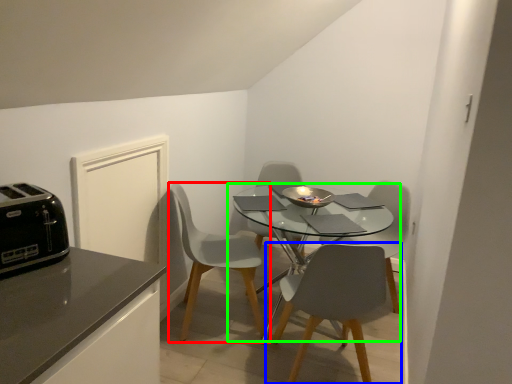
Question: Considering the real-world distances, which object is closest to chair (highlighted by a red box)? chair (highlighted by a blue box) or kitchen & dining room table (highlighted by a green box).

Choices:
 (A) chair
 (B) kitchen & dining room table

Answer: (B)